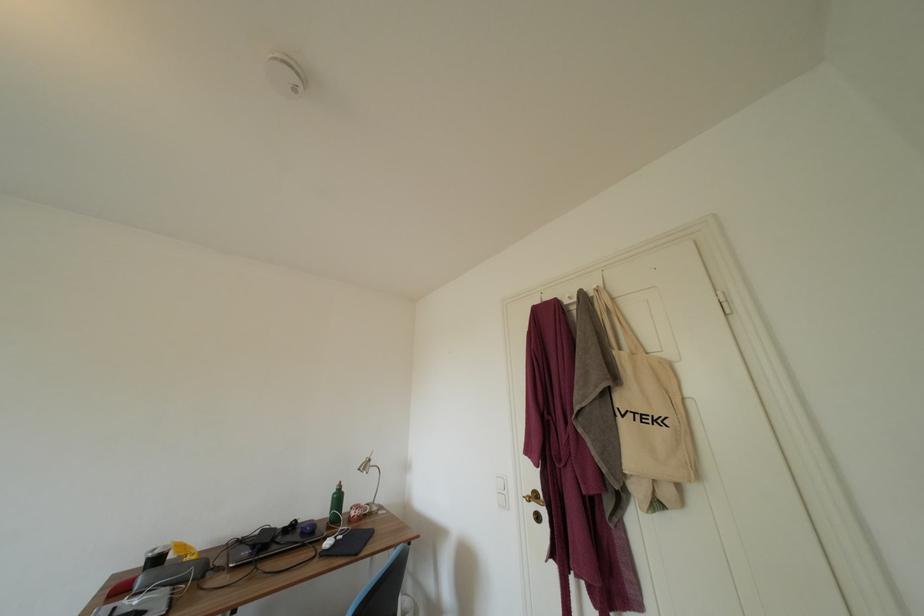
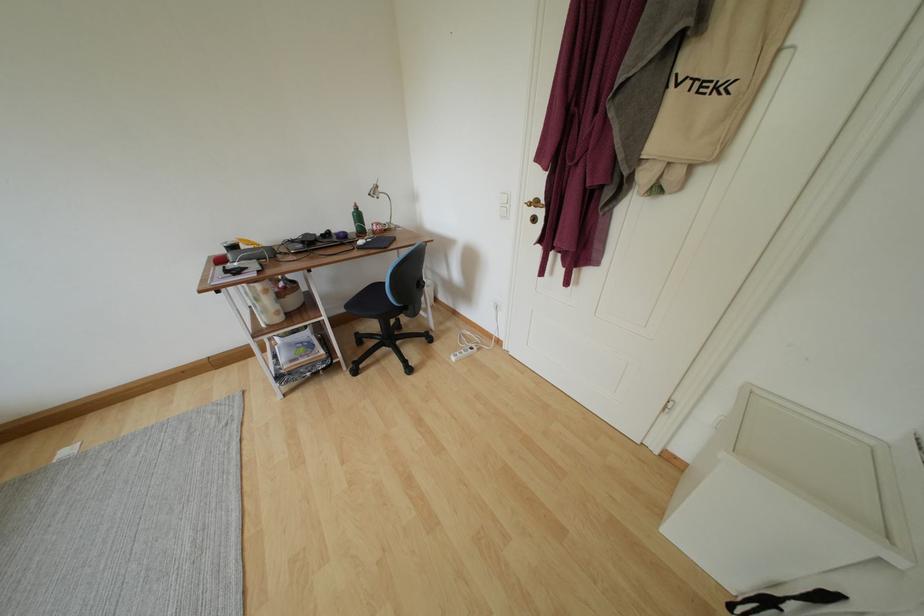
Locate, in the second image, the point that corresponds to point 541,500 in the first image.

(541, 207)